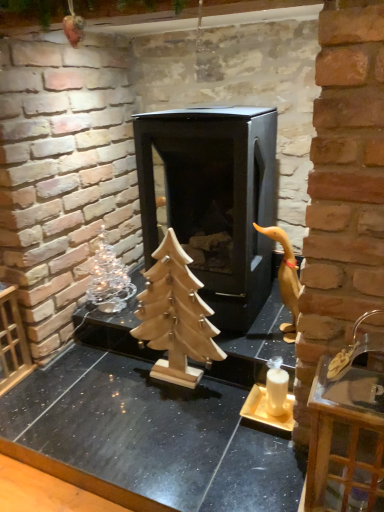
Find the location of a particular element. This screenshot has width=384, height=512. free region on the left part of wooden duckling at right is located at coordinates (239, 346).